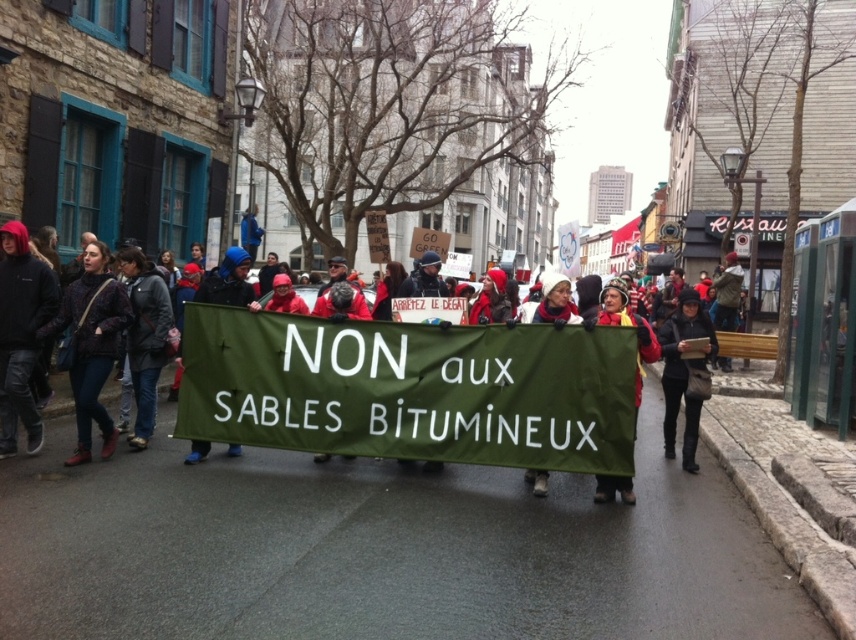
Question: From the image, what is the correct spatial relationship of patterned fabric jacket at left in relation to matte green banner at center?

Choices:
 (A) below
 (B) above

Answer: (A)

Question: Can you confirm if green fabric banner at center is thinner than dark gray jacket at center?

Choices:
 (A) yes
 (B) no

Answer: (B)

Question: Which point is farther to the camera?

Choices:
 (A) (22, 288)
 (B) (200, 292)

Answer: (B)

Question: Is black fleece jacket at left positioned in front of dark gray jacket at center?

Choices:
 (A) no
 (B) yes

Answer: (B)

Question: Among these objects, which one is farthest from the camera?

Choices:
 (A) black leather jacket at center
 (B) green fabric banner at center
 (C) blue knit hat at center
 (D) matte green banner at center

Answer: (C)

Question: Among these objects, which one is nearest to the camera?

Choices:
 (A) matte green banner at center
 (B) black fleece jacket at left
 (C) green fabric banner at center
 (D) patterned fabric jacket at left

Answer: (C)